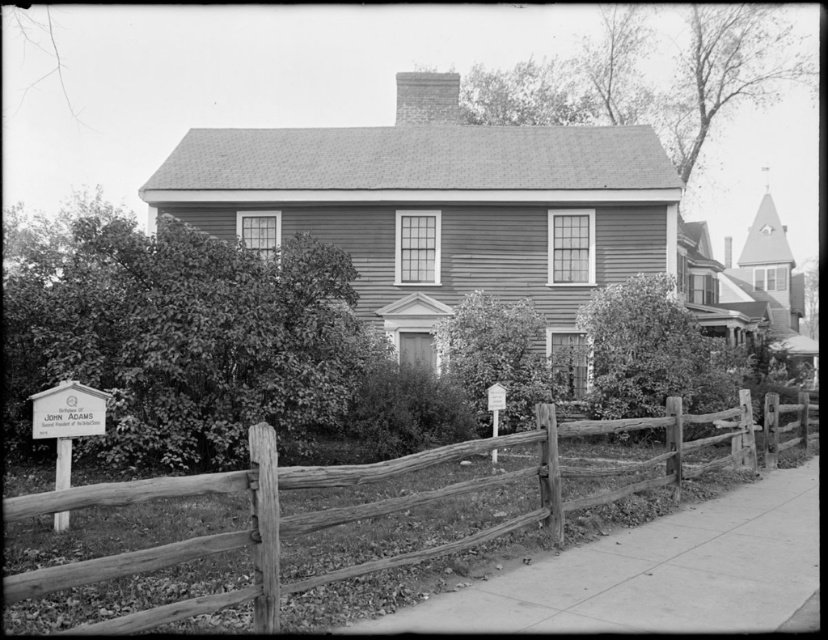
You are standing in front of the house and notice a specific point marked at coordinates point (355, 508). Based on the scene description, what object or feature is located at this point?

The point (355, 508) corresponds to the wooden at lower left.

You are a visitor approaching the house and see the wooden at lower left and the white wood sign at lower left. Which object would you notice first as you walk towards the house?

The wooden at lower left would be noticed first because it is larger in size compared to the white wood sign at lower left.